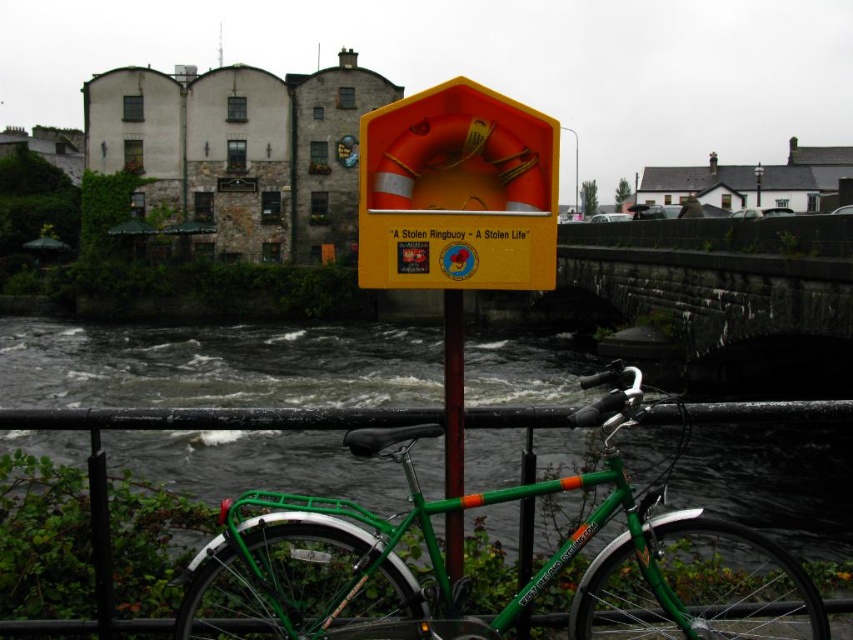
Who is higher up, green matte bicycle at lower center or orange/yellow plastic lifebuoy at center?

orange/yellow plastic lifebuoy at center

Can you confirm if green matte bicycle at lower center is positioned to the left of orange/yellow plastic lifebuoy at center?

In fact, green matte bicycle at lower center is to the right of orange/yellow plastic lifebuoy at center.

Is point (227, 636) positioned behind point (514, 278)?

Yes, point (227, 636) is behind point (514, 278).

Locate an element on the screen. Image resolution: width=853 pixels, height=640 pixels. green matte bicycle at lower center is located at coordinates (467, 582).

Describe the element at coordinates (457, 193) in the screenshot. I see `orange/yellow plastic lifebuoy at center` at that location.

Who is positioned more to the left, orange/yellow plastic lifebuoy at center or green painted metal pole at center?

orange/yellow plastic lifebuoy at center

The height and width of the screenshot is (640, 853). What are the coordinates of `orange/yellow plastic lifebuoy at center` in the screenshot? It's located at (457, 193).

Is point (624, 488) positioned after point (451, 515)?

No, (624, 488) is closer to viewer.

Is green matte bicycle at lower center smaller than green painted metal pole at center?

No.

Measure the distance between point (296, 525) and camera.

They are 41.20 feet apart.

Locate an element on the screen. The width and height of the screenshot is (853, 640). green matte bicycle at lower center is located at coordinates (467, 582).